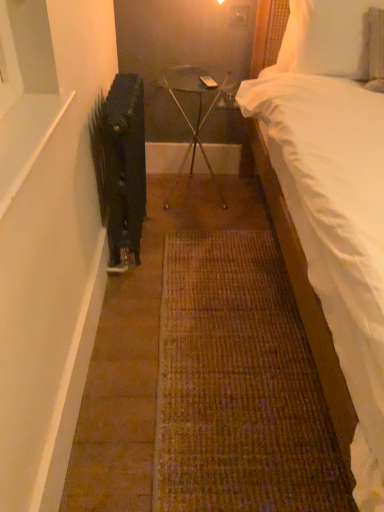
Describe the element at coordinates (196, 142) in the screenshot. I see `metallic glass table at center` at that location.

What is the approximate width of white soft pillow at upper right?

The width of white soft pillow at upper right is 13.82 centimeters.

What do you see at coordinates (327, 38) in the screenshot? I see `white soft pillow at upper right` at bounding box center [327, 38].

Where is `black matte radiator at left`? Image resolution: width=384 pixels, height=512 pixels. black matte radiator at left is located at coordinates (120, 162).

Where is `bed that appears below the metallic glass table at center (from the image's perspective)`? Image resolution: width=384 pixels, height=512 pixels. bed that appears below the metallic glass table at center (from the image's perspective) is located at coordinates (335, 197).

Does metallic glass table at center have a smaller size compared to white soft bed at right?

Yes.

Considering the relative positions of metallic glass table at center and white soft bed at right in the image provided, is metallic glass table at center to the left of white soft bed at right from the viewer's perspective?

Indeed, metallic glass table at center is positioned on the left side of white soft bed at right.

Does metallic glass table at center come behind white soft bed at right?

Yes, metallic glass table at center is further from the viewer.

Is white soft pillow at upper right placed right next to white soft bed at right?

No.

Consider the image. From a real-world perspective, which object rests below the other?

white soft bed at right, from a real-world perspective.

Does white soft pillow at upper right have a larger size compared to white soft bed at right?

No.

Which is in front, point (297, 69) or point (289, 131)?

Positioned in front is point (289, 131).

In the scene shown: Considering the positions of objects metallic glass table at center and white soft pillow at upper right in the image provided, who is more to the right, metallic glass table at center or white soft pillow at upper right?

white soft pillow at upper right is more to the right.

This screenshot has height=512, width=384. What are the coordinates of `pillow that is above the metallic glass table at center (from the image's perspective)` in the screenshot? It's located at (327, 38).

How distant is metallic glass table at center from white soft pillow at upper right?

They are 22.63 inches apart.

Is metallic glass table at center not inside black matte radiator at left?

Yes, metallic glass table at center is not within black matte radiator at left.

Could you tell me if metallic glass table at center is turned towards black matte radiator at left?

No, metallic glass table at center is not aimed at black matte radiator at left.

Is metallic glass table at center thinner than black matte radiator at left?

No, metallic glass table at center is not thinner than black matte radiator at left.

From a real-world perspective, is metallic glass table at center over black matte radiator at left?

No, from a real-world perspective, metallic glass table at center is not over black matte radiator at left

Is point (363, 379) closer or farther from the camera than point (357, 42)?

Point (363, 379) is closer to the camera than point (357, 42).

From a real-world perspective, is white soft bed at right positioned above or below white soft pillow at upper right?

In terms of real-world spatial position, white soft bed at right is below white soft pillow at upper right.

Considering the relative sizes of white soft bed at right and white soft pillow at upper right in the image provided, is white soft bed at right shorter than white soft pillow at upper right?

Incorrect, the height of white soft bed at right does not fall short of that of white soft pillow at upper right.

What's the angular difference between white soft bed at right and white soft pillow at upper right's facing directions?

There is a 3.42-degree angle between the facing directions of white soft bed at right and white soft pillow at upper right.

How different are the orientations of white soft bed at right and black matte radiator at left in degrees?

88.8 degrees.

Is white soft bed at right not near black matte radiator at left?

No, white soft bed at right is not far from black matte radiator at left.

Is point (370, 291) closer or farther from the camera than point (143, 94)?

Point (370, 291) is closer to the camera than point (143, 94).

Considering the sizes of objects white soft bed at right and black matte radiator at left in the image provided, who is smaller, white soft bed at right or black matte radiator at left?

black matte radiator at left.

Is black matte radiator at left closer to the viewer compared to metallic glass table at center?

Yes, black matte radiator at left is closer to the viewer.

Does black matte radiator at left have a lesser height compared to metallic glass table at center?

No.

Are black matte radiator at left and metallic glass table at center located far from each other?

black matte radiator at left is actually quite close to metallic glass table at center.

Considering the relative positions of black matte radiator at left and metallic glass table at center in the image provided, is black matte radiator at left to the left or to the right of metallic glass table at center?

black matte radiator at left is positioned on metallic glass table at center's left side.

This screenshot has height=512, width=384. In order to click on furniture that is behind the white soft bed at right in this screenshot , I will do `click(196, 142)`.

Locate an element on the screen. The height and width of the screenshot is (512, 384). bed in front of the white soft pillow at upper right is located at coordinates (335, 197).

Based on their spatial positions, is white soft bed at right or black matte radiator at left further from metallic glass table at center?

white soft bed at right lies further to metallic glass table at center than the other object.

Considering their positions, is white soft bed at right positioned further to black matte radiator at left than metallic glass table at center?

white soft bed at right.

From the image, which object appears to be farther from white soft pillow at upper right, metallic glass table at center or black matte radiator at left?

black matte radiator at left.

Considering their positions, is black matte radiator at left positioned closer to white soft bed at right than white soft pillow at upper right?

white soft pillow at upper right is closer to white soft bed at right.

From the image, which object appears to be farther from metallic glass table at center, white soft pillow at upper right or black matte radiator at left?

Among the two, black matte radiator at left is located further to metallic glass table at center.

Based on their spatial positions, is white soft pillow at upper right or metallic glass table at center further from black matte radiator at left?

white soft pillow at upper right is positioned further to the anchor black matte radiator at left.

From the image, which object appears to be nearer to black matte radiator at left, white soft bed at right or white soft pillow at upper right?

white soft bed at right is closer to black matte radiator at left.

In the scene shown: Based on their spatial positions, is black matte radiator at left or metallic glass table at center further from white soft pillow at upper right?

Based on the image, black matte radiator at left appears to be further to white soft pillow at upper right.

This screenshot has height=512, width=384. Identify the location of pillow between white soft bed at right and metallic glass table at center in the front-back direction. (327, 38).

Identify the location of furniture between black matte radiator at left and white soft pillow at upper right in the horizontal direction. (196, 142).

This screenshot has height=512, width=384. Identify the location of radiator between white soft bed at right and metallic glass table at center in the front-back direction. (120, 162).

Where is `radiator between white soft bed at right and white soft pillow at upper right along the z-axis`? radiator between white soft bed at right and white soft pillow at upper right along the z-axis is located at coordinates (120, 162).